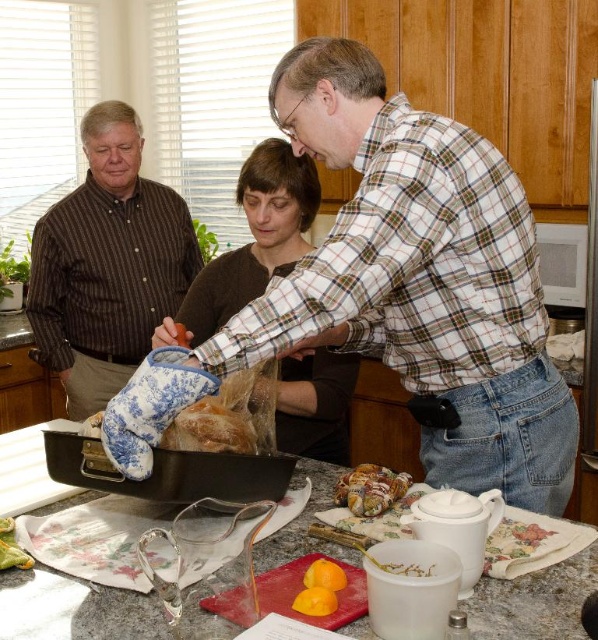
You are a guest in the kitchen and want to reach the blue floral oven mitt at center to grab a hot dish. However, there is a brown striped shirt at left in your way. Can you move around it to access the oven mitt?

The brown striped shirt at left is further to the viewer than the blue floral oven mitt at center, so you can move around the brown striped shirt at left to access the blue floral oven mitt at center since it is closer to you.

You are organizing a kitchen photoshoot and need to ensure all items are within a specific area. The camera is positioned to capture the scene within a frame that covers coordinates from 0 to 1 on both axes. Given the brown striped shirt at left is at point 0.414, 0.181, will it be fully visible within the frame?

The brown striped shirt at left is located at point (108, 264), which falls within the 0 to 1 coordinate frame, so it will be fully visible.